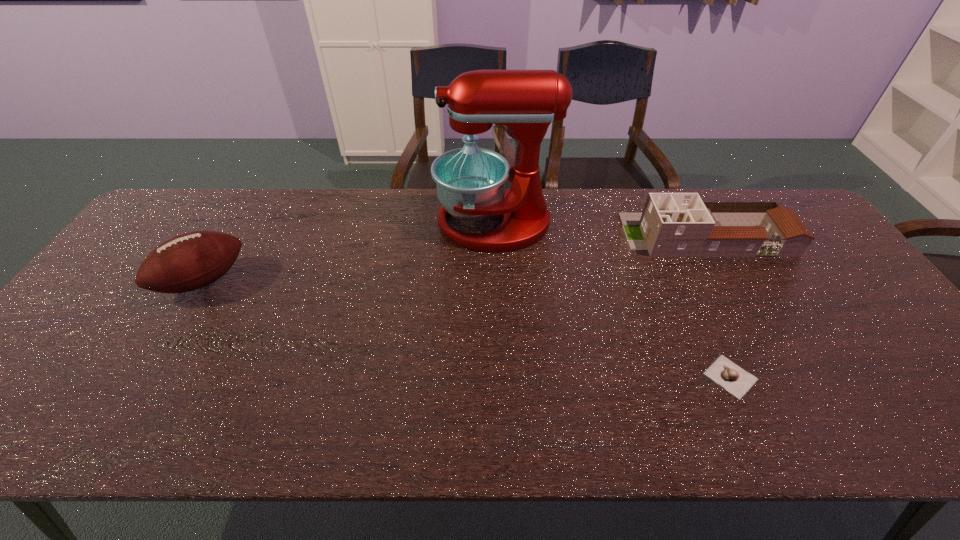
This screenshot has width=960, height=540. I want to click on vacant region that satisfies the following two spatial constraints: 1. on the front side of the football (American); 2. on the left side of the shortest object, so click(146, 377).

This screenshot has height=540, width=960. I want to click on vacant position in the image that satisfies the following two spatial constraints: 1. at the main entrance of the dollhouse; 2. on the front side of the football (American), so click(x=731, y=281).